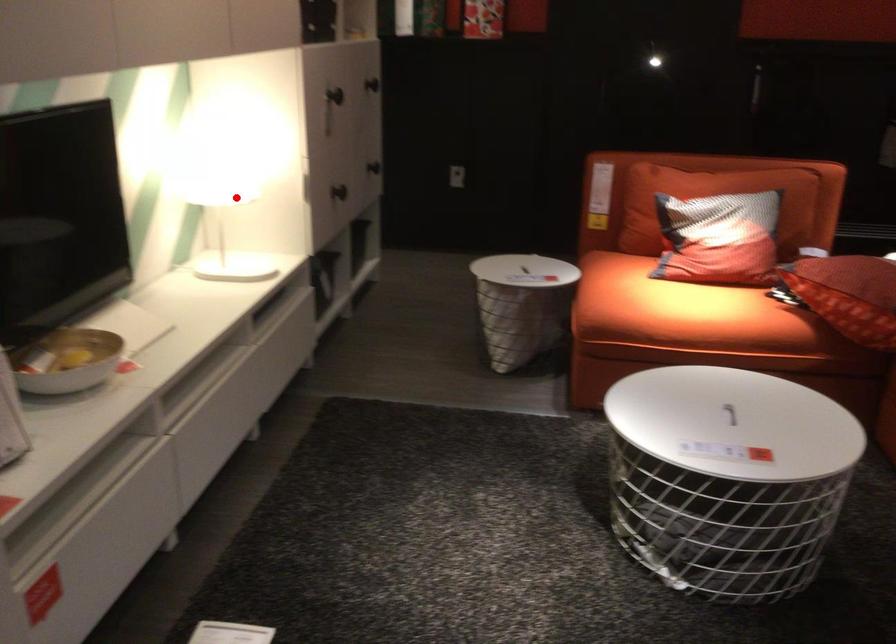
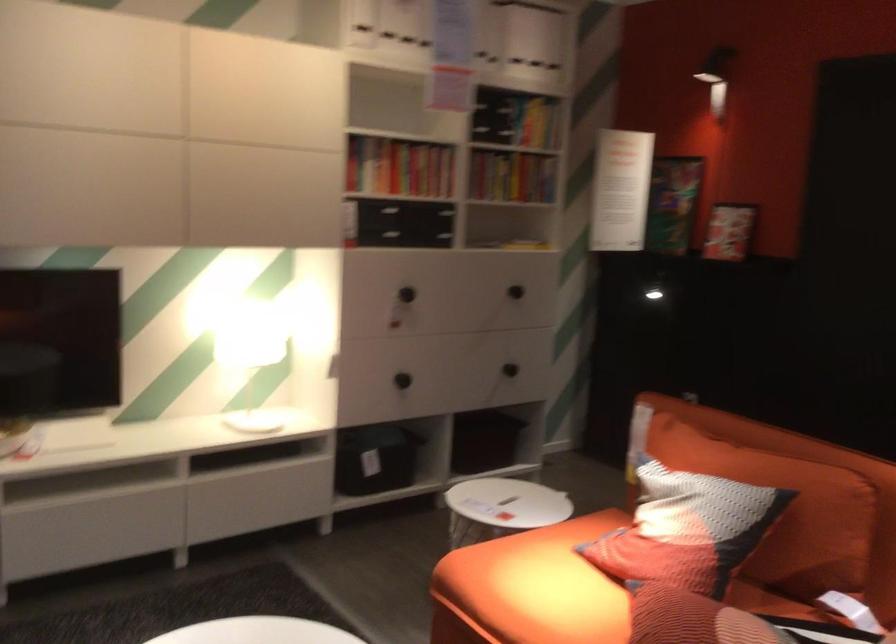
Question: I am providing you with two images of the same scene from different viewpoints. In image1, a red point is highlighted. Considering the same 3D point in image2, which of the following is correct?

Choices:
 (A) It is closer
 (B) It is farther

Answer: (B)